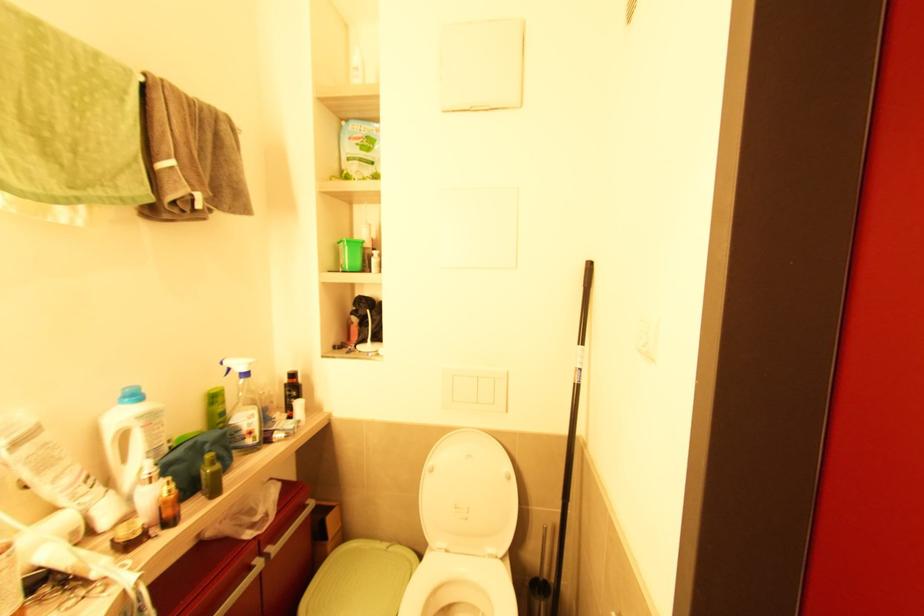
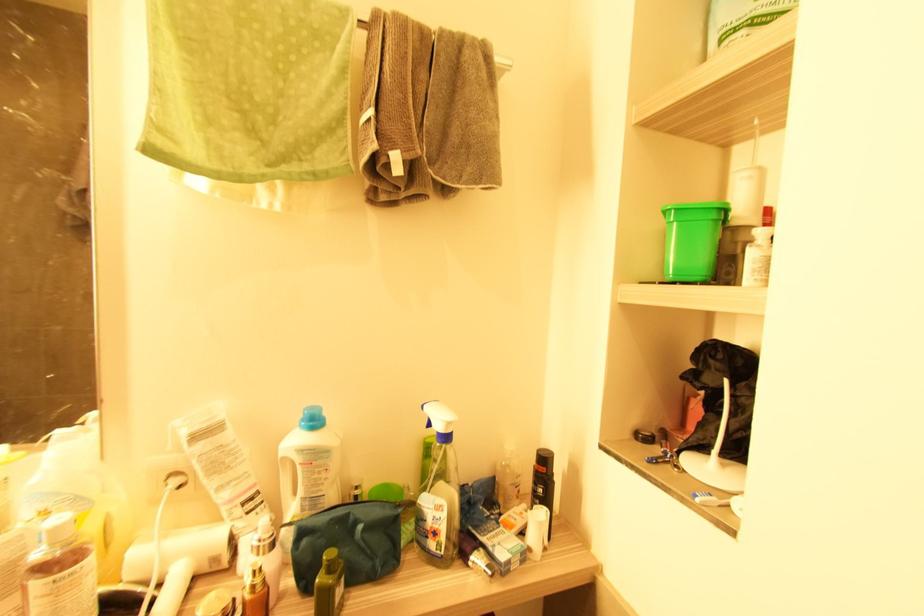
Where in the second image is the point corresponding to (247,440) from the first image?

(429, 539)